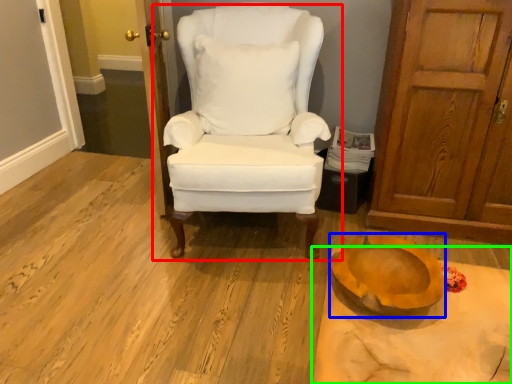
Question: Considering the real-world distances, which object is farthest from chair (highlighted by a red box)? oval (highlighted by a blue box) or table (highlighted by a green box)?

Choices:
 (A) oval
 (B) table

Answer: (B)